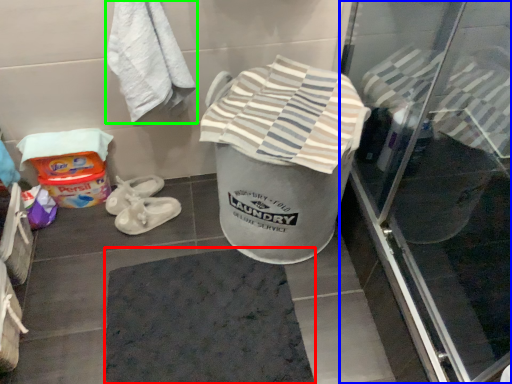
Question: Considering the real-world distances, which object is closest to bath mat (highlighted by a red box)? screen door (highlighted by a blue box) or towel (highlighted by a green box).

Choices:
 (A) screen door
 (B) towel

Answer: (A)